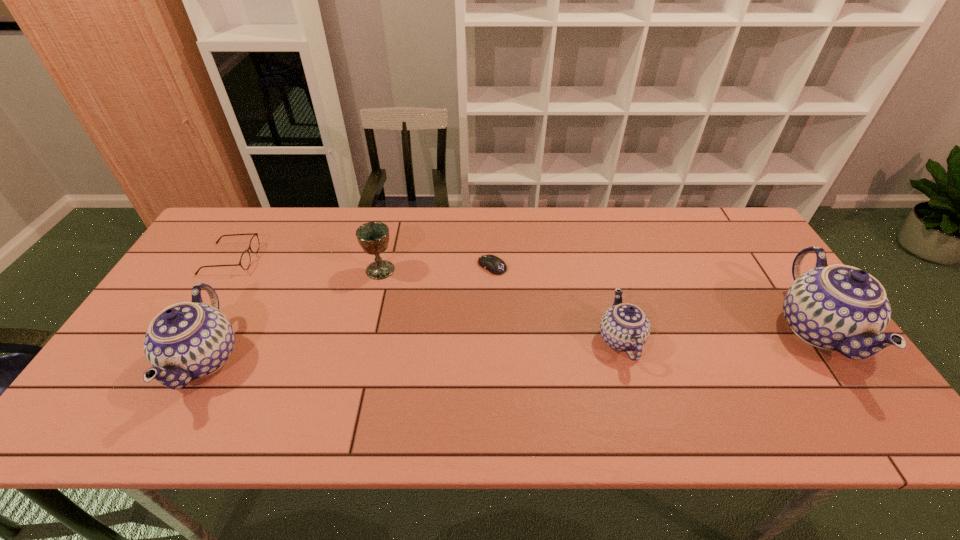
Identify which object is the closest to the third object from left to right. Please provide its 2D coordinates. Your answer should be formatted as a tuple, i.e. [(x, y)], where the tuple contains the x and y coordinates of a point satisfying the conditions above.

[(495, 265)]

Identify which object is the closest to the fifth shortest object. Please provide its 2D coordinates. Your answer should be formatted as a tuple, i.e. [(x, y)], where the tuple contains the x and y coordinates of a point satisfying the conditions above.

[(245, 260)]

At what (x,y) coordinates should I click in order to perform the action: click on the closest chinaware to the fifth object from left to right. Please return your answer as a coordinate pair (x, y). Looking at the image, I should click on (838, 307).

Locate which chinaware is the second closest to the fifth shortest object. Please provide its 2D coordinates. Your answer should be formatted as a tuple, i.e. [(x, y)], where the tuple contains the x and y coordinates of a point satisfying the conditions above.

[(838, 307)]

Locate an element on the screen. The image size is (960, 540). vacant region that satisfies the following two spatial constraints: 1. on the front side of the computer equipment; 2. at the spout of the second tallest chinaware is located at coordinates (495, 360).